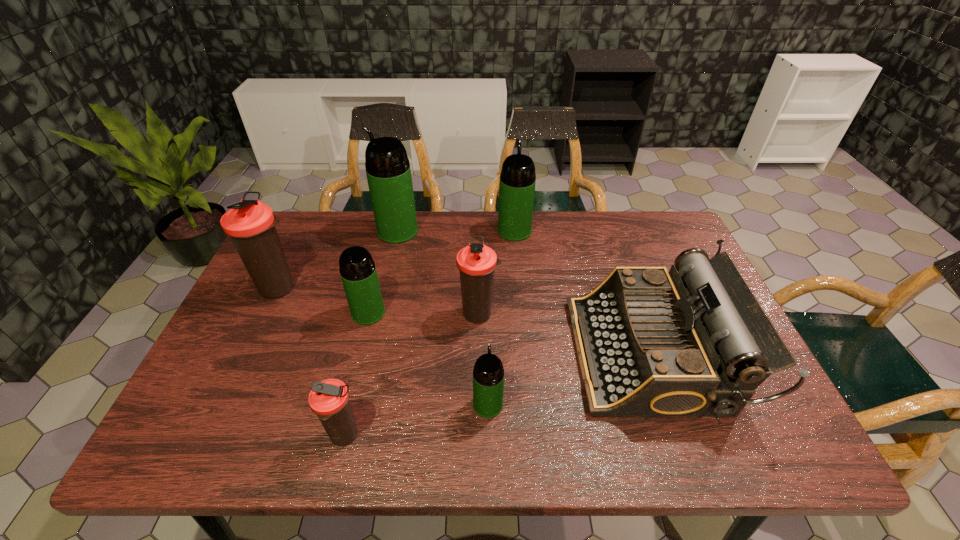
Identify the location of the biggest green thermos bottle. (388, 171).

Identify the location of the tallest object. (388, 171).

You are a GUI agent. You are given a task and a screenshot of the screen. Output one action in this format:
    pyautogui.click(x=<x>, y=<y>)
    Task: Click on the second biggest green thermos bottle
    Image resolution: width=960 pixels, height=540 pixels.
    Given the screenshot: What is the action you would take?
    pyautogui.click(x=517, y=178)

Find the location of a particular element. The width and height of the screenshot is (960, 540). the seventh object from left to right is located at coordinates (517, 178).

What are the coordinates of `the leftmost thermos bottle` in the screenshot? It's located at (250, 224).

Find the location of `the leftmost object`. the leftmost object is located at coordinates (250, 224).

Identify the location of the third farthest green thermos bottle. The height and width of the screenshot is (540, 960). [x=358, y=272].

Locate an element on the screen. Image resolution: width=960 pixels, height=540 pixels. the second biggest brown thermos bottle is located at coordinates (476, 262).

Find the location of a particular element. This screenshot has height=540, width=960. the rightmost object is located at coordinates (651, 342).

The width and height of the screenshot is (960, 540). I want to click on the nearest green thermos bottle, so click(488, 374).